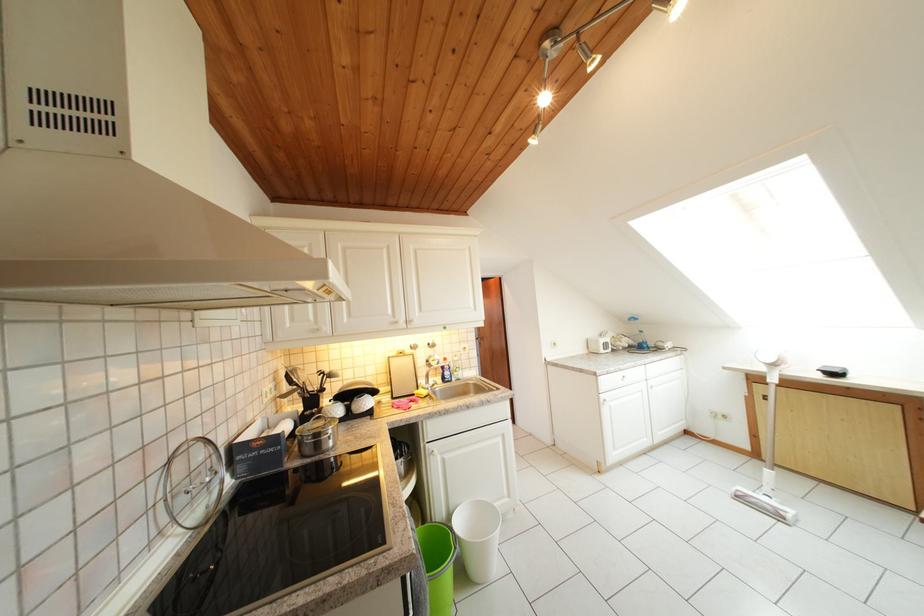
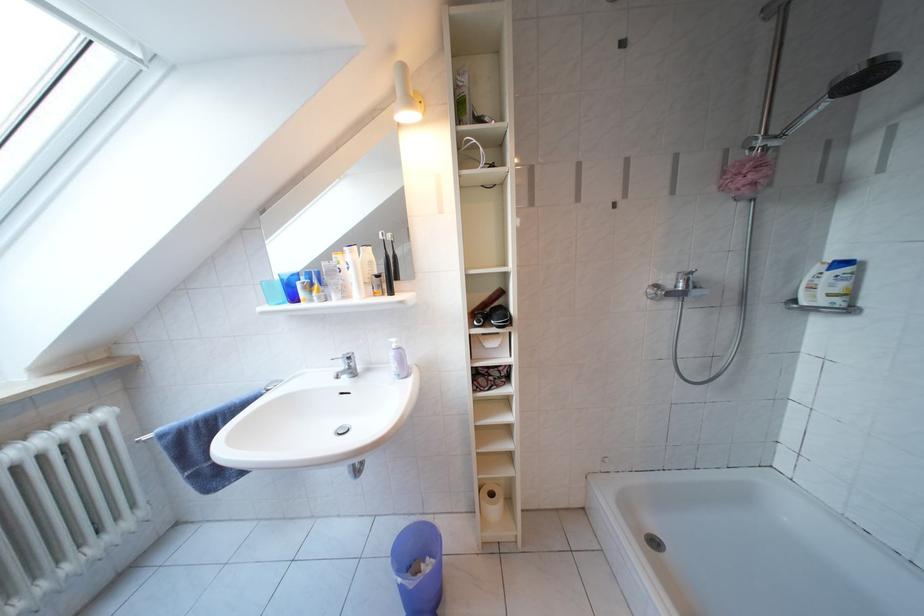
Question: In a continuous first-person perspective shot, in which direction is the camera moving?

Choices:
 (A) Left
 (B) Right
 (C) Forward
 (D) Backward

Answer: (C)